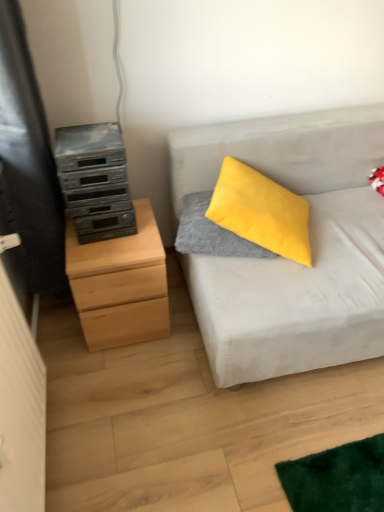
This screenshot has height=512, width=384. I want to click on silver metallic stereo at left, so click(x=95, y=180).

What is the approximate width of light gray fabric couch at right?

light gray fabric couch at right is 37.41 inches in width.

Describe the element at coordinates (120, 284) in the screenshot. The height and width of the screenshot is (512, 384). I see `natural wood chest of drawers at left` at that location.

The width and height of the screenshot is (384, 512). I want to click on velvety gray pillow at center, so click(x=210, y=233).

Between silver metallic stereo at left and velvety gray pillow at center, which one appears on the left side from the viewer's perspective?

silver metallic stereo at left.

Is silver metallic stereo at left turned away from velvety gray pillow at center?

No.

Which of these two, silver metallic stereo at left or velvety gray pillow at center, is wider?

velvety gray pillow at center is wider.

Is silver metallic stereo at left bigger than velvety gray pillow at center?

Yes, silver metallic stereo at left is bigger than velvety gray pillow at center.

Is there a large distance between light gray fabric couch at right and silver metallic stereo at left?

light gray fabric couch at right is near silver metallic stereo at left, not far away.

In the image, is light gray fabric couch at right on the left side or the right side of silver metallic stereo at left?

light gray fabric couch at right is to the right of silver metallic stereo at left.

Considering the positions of point (336, 260) and point (87, 230), is point (336, 260) closer or farther from the camera than point (87, 230)?

Point (336, 260) is farther from the camera than point (87, 230).

This screenshot has height=512, width=384. I want to click on appliance lying on the left of light gray fabric couch at right, so click(x=95, y=180).

Would you consider silver metallic stereo at left to be distant from light gray fabric couch at right?

No, silver metallic stereo at left is not far from light gray fabric couch at right.

Considering the relative sizes of silver metallic stereo at left and light gray fabric couch at right in the image provided, is silver metallic stereo at left thinner than light gray fabric couch at right?

Correct, the width of silver metallic stereo at left is less than that of light gray fabric couch at right.

Visually, is silver metallic stereo at left positioned to the left or to the right of light gray fabric couch at right?

Based on their positions, silver metallic stereo at left is located to the left of light gray fabric couch at right.

Does point (89, 332) come closer to viewer compared to point (241, 248)?

No, it is behind (241, 248).

From the image's perspective, which one is positioned lower, natural wood chest of drawers at left or velvety gray pillow at center?

natural wood chest of drawers at left, from the image's perspective.

Measure the distance between natural wood chest of drawers at left and velvety gray pillow at center.

11.09 inches.

Visually, is natural wood chest of drawers at left positioned to the left or to the right of velvety gray pillow at center?

From the image, it's evident that natural wood chest of drawers at left is to the left of velvety gray pillow at center.

Which is more to the right, light gray fabric couch at right or velvety gray pillow at center?

From the viewer's perspective, light gray fabric couch at right appears more on the right side.

Which point is more distant from viewer, (364, 293) or (258, 250)?

Point (258, 250)

In the scene shown: Considering the relative sizes of light gray fabric couch at right and velvety gray pillow at center in the image provided, is light gray fabric couch at right taller than velvety gray pillow at center?

Indeed, light gray fabric couch at right has a greater height compared to velvety gray pillow at center.

Which object is closer to the camera, light gray fabric couch at right or velvety gray pillow at center?

Positioned in front is light gray fabric couch at right.

What are the coordinates of `appliance in front of the velvety gray pillow at center` in the screenshot? It's located at (95, 180).

Can silver metallic stereo at left be found inside velvety gray pillow at center?

No, silver metallic stereo at left is not a part of velvety gray pillow at center.

Is velvety gray pillow at center to the left or to the right of silver metallic stereo at left in the image?

Based on their positions, velvety gray pillow at center is located to the right of silver metallic stereo at left.

Could you tell me if velvety gray pillow at center is turned towards silver metallic stereo at left?

No.

Looking at their sizes, would you say natural wood chest of drawers at left is wider or thinner than silver metallic stereo at left?

Clearly, natural wood chest of drawers at left has more width compared to silver metallic stereo at left.

Which point is more distant from viewer, (83,274) or (72,205)?

The point (83,274) is more distant.

From the image's perspective, does natural wood chest of drawers at left appear higher than silver metallic stereo at left?

No, from the image's perspective, natural wood chest of drawers at left is not above silver metallic stereo at left.

Is natural wood chest of drawers at left facing away from silver metallic stereo at left?

No, natural wood chest of drawers at left's orientation is not away from silver metallic stereo at left.

Where is `gray behind the silver metallic stereo at left`? Image resolution: width=384 pixels, height=512 pixels. gray behind the silver metallic stereo at left is located at coordinates (210, 233).

Locate an element on the screen. studio couch in front of the silver metallic stereo at left is located at coordinates (287, 259).

Which object lies further to the anchor point natural wood chest of drawers at left, silver metallic stereo at left or velvety gray pillow at center?

Among the two, velvety gray pillow at center is located further to natural wood chest of drawers at left.

Consider the image. Estimate the real-world distances between objects in this image. Which object is closer to velvety gray pillow at center, light gray fabric couch at right or natural wood chest of drawers at left?

Among the two, light gray fabric couch at right is located nearer to velvety gray pillow at center.

When comparing their distances from velvety gray pillow at center, does natural wood chest of drawers at left or silver metallic stereo at left seem closer?

natural wood chest of drawers at left.

Which object lies nearer to the anchor point light gray fabric couch at right, velvety gray pillow at center or natural wood chest of drawers at left?

The object closer to light gray fabric couch at right is velvety gray pillow at center.

From the image, which object appears to be nearer to silver metallic stereo at left, light gray fabric couch at right or natural wood chest of drawers at left?

natural wood chest of drawers at left is positioned closer to the anchor silver metallic stereo at left.

Based on their spatial positions, is silver metallic stereo at left or natural wood chest of drawers at left closer to light gray fabric couch at right?

natural wood chest of drawers at left.

Based on the photo, based on their spatial positions, is silver metallic stereo at left or velvety gray pillow at center closer to light gray fabric couch at right?

velvety gray pillow at center lies closer to light gray fabric couch at right than the other object.

Which object lies further to the anchor point natural wood chest of drawers at left, velvety gray pillow at center or light gray fabric couch at right?

Among the two, light gray fabric couch at right is located further to natural wood chest of drawers at left.

I want to click on the chest of drawers situated between silver metallic stereo at left and velvety gray pillow at center from left to right, so click(120, 284).

The image size is (384, 512). I want to click on gray located between silver metallic stereo at left and light gray fabric couch at right in the left-right direction, so click(x=210, y=233).

You are a GUI agent. You are given a task and a screenshot of the screen. Output one action in this format:
    pyautogui.click(x=<x>, y=<y>)
    Task: Click on the gray located between natural wood chest of drawers at left and light gray fabric couch at right in the left-right direction
    This screenshot has height=512, width=384.
    Given the screenshot: What is the action you would take?
    pyautogui.click(x=210, y=233)

Locate an element on the screen. chest of drawers between silver metallic stereo at left and light gray fabric couch at right from left to right is located at coordinates (120, 284).